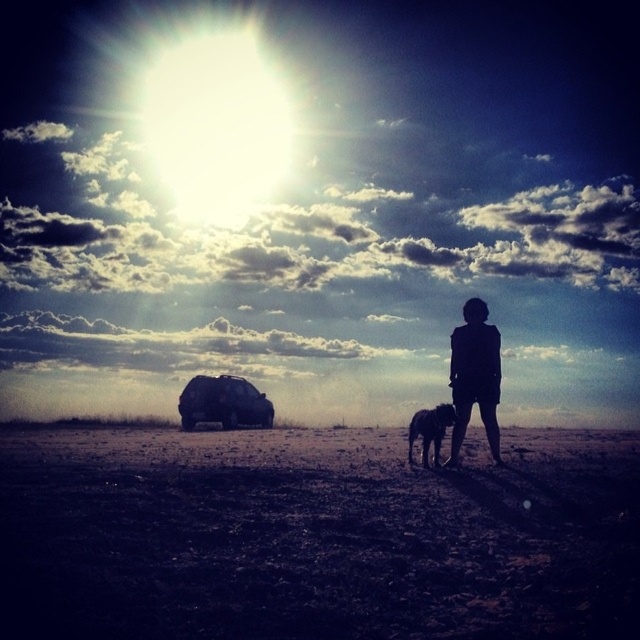
You are planning a road trip and need to decide whether your shiny black dog at center can comfortably ride in the back of the satin black suv at lower center. Based on their sizes, is this feasible?

The satin black suv at lower center is larger in size than the shiny black dog at center, so the shiny black dog at center should have enough space to ride comfortably in the back of the satin black suv at lower center.

You are a photographer trying to capture a photo of the silhouette figure at center and the shiny black dog at center. Since the sun is directly behind them, you need to adjust your camera settings to handle the backlighting. Which object should you focus on first to ensure proper exposure, the one closer to you or the one farther away?

The silhouette figure at center is located above the shiny black dog at center. Since the sun is behind them, focusing on the closer object will help balance the exposure. However, the description does not specify which is closer. To ensure proper exposure, focus on the object that is closer to you. Without distance details, you might need to adjust settings for both.

You are a photographer trying to capture a landscape photo. You notice the dark brown dirt field at center and the satin black suv at lower center. Which object is blocking the view of the other?

The dark brown dirt field at center is positioned over the satin black suv at lower center, so it is blocking the view of the suv.